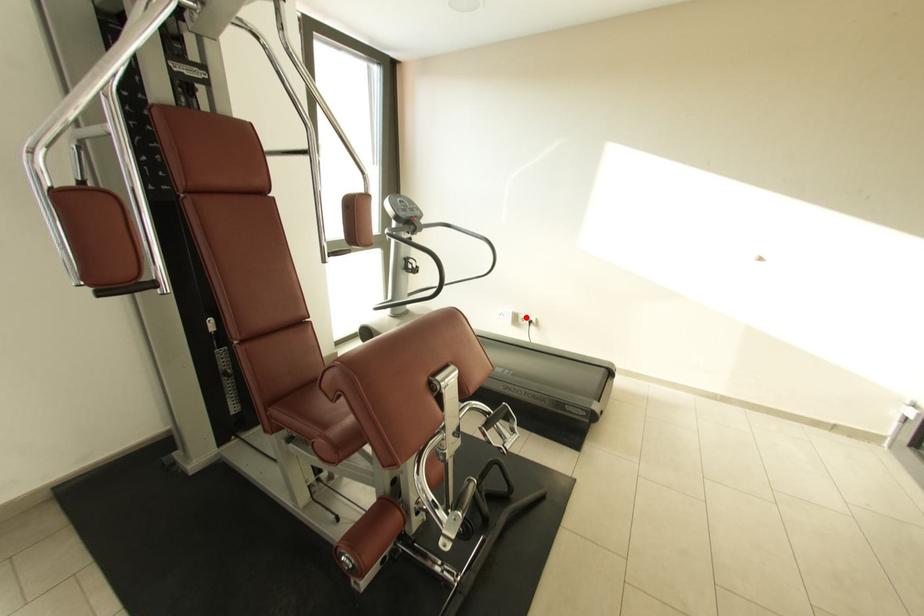
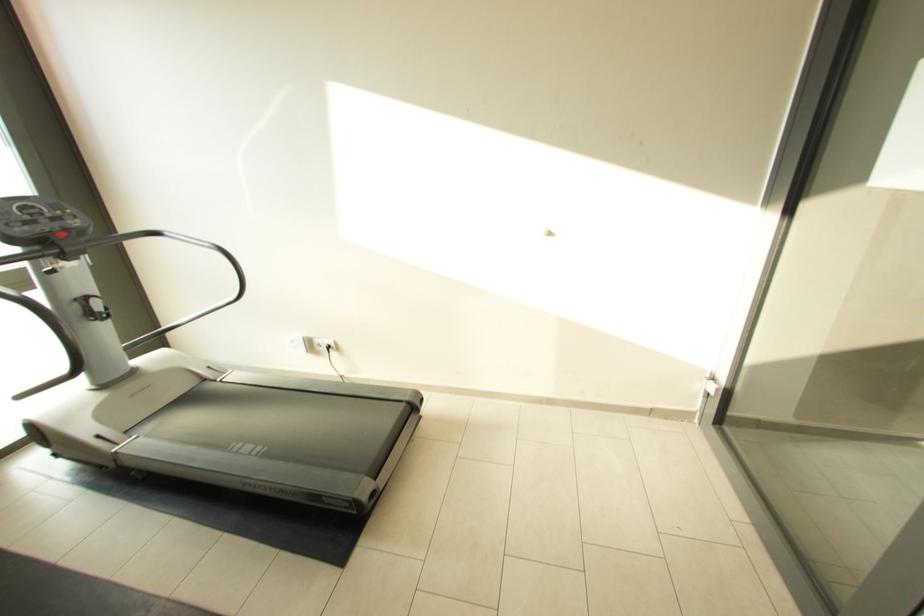
Find the pixel in the second image that matches the highlighted location in the first image.

(322, 342)